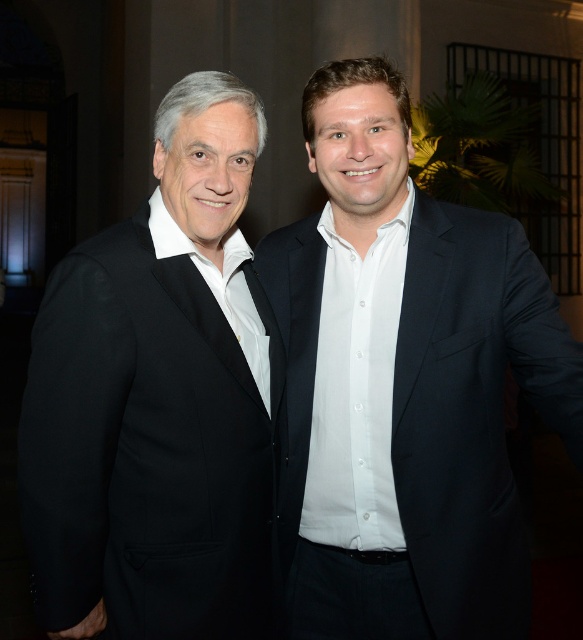
Who is positioned more to the right, white smooth suit at center or black matte suit at left?

Positioned to the right is white smooth suit at center.

Can you confirm if white smooth suit at center is shorter than black matte suit at left?

No, white smooth suit at center is not shorter than black matte suit at left.

Who is more distant from viewer, [424,358] or [226,202]?

Positioned behind is point [424,358].

In order to click on white smooth suit at center in this screenshot , I will do `click(405, 385)`.